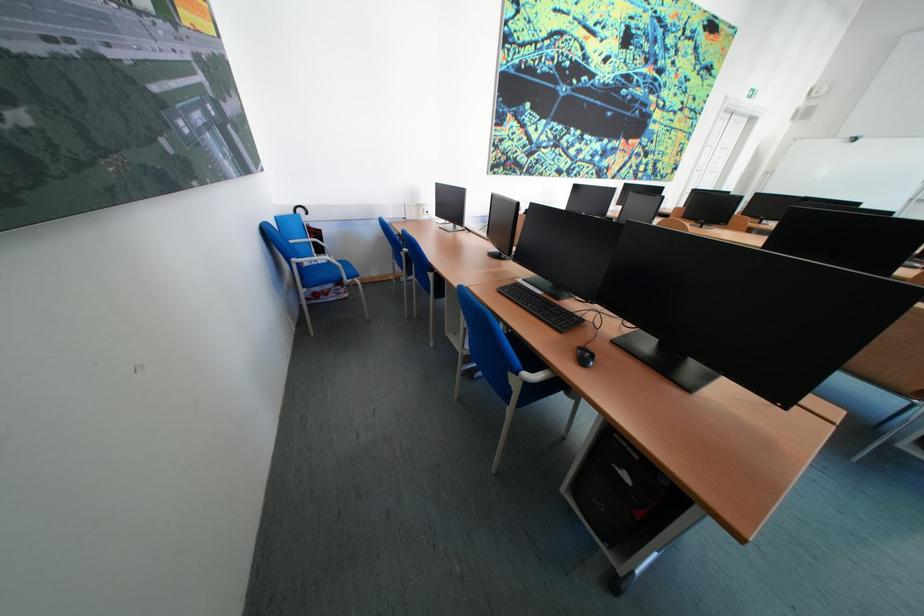
The height and width of the screenshot is (616, 924). Describe the element at coordinates (318, 272) in the screenshot. I see `the blue chair armrest` at that location.